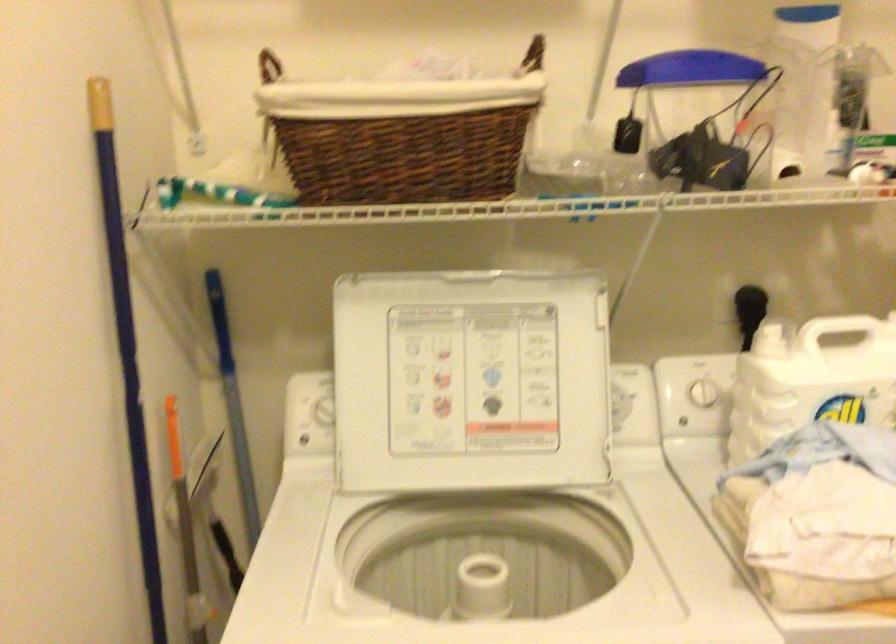
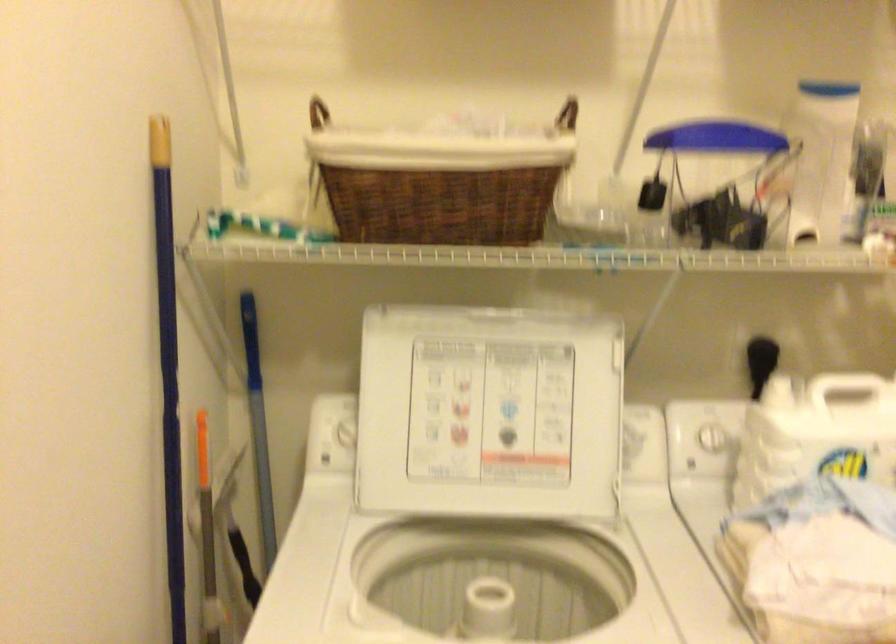
The point at (470, 381) is marked in the first image. Where is the corresponding point in the second image?

(488, 413)